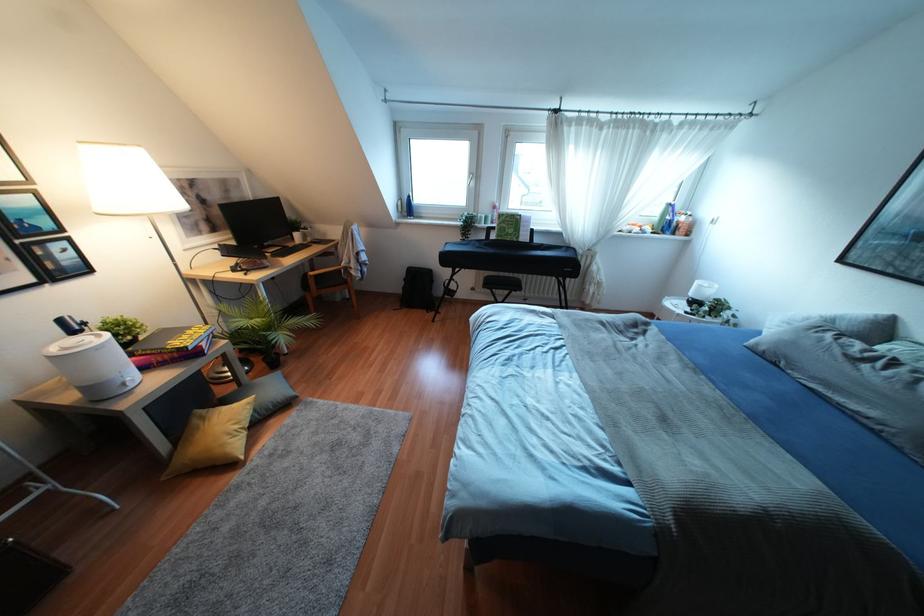
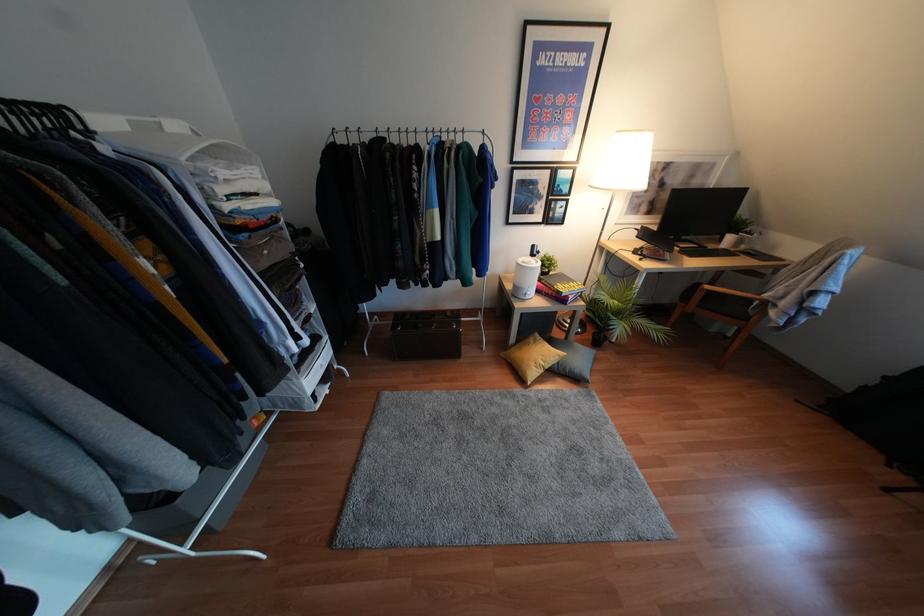
In the second image, find the point that corresponds to point 253,410 in the first image.

(556, 362)